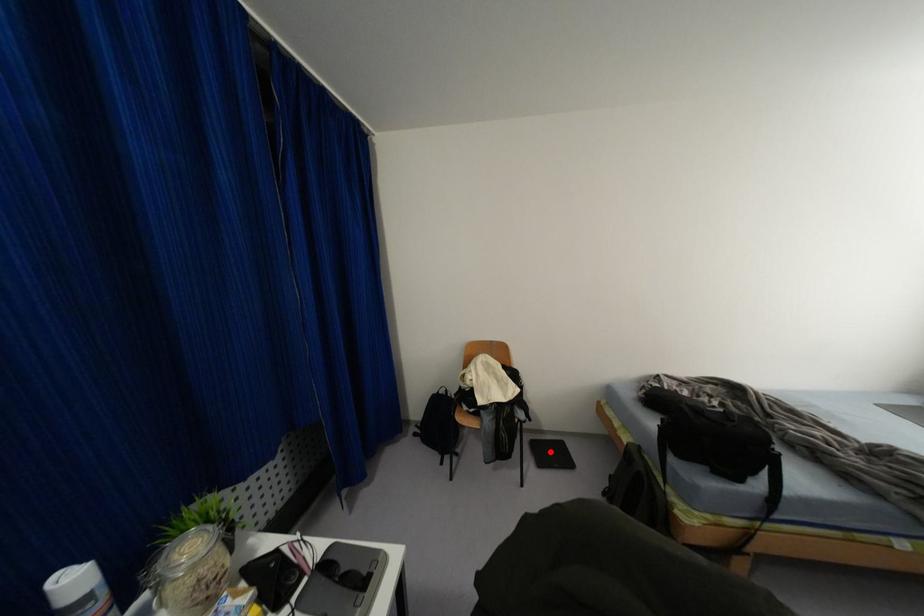
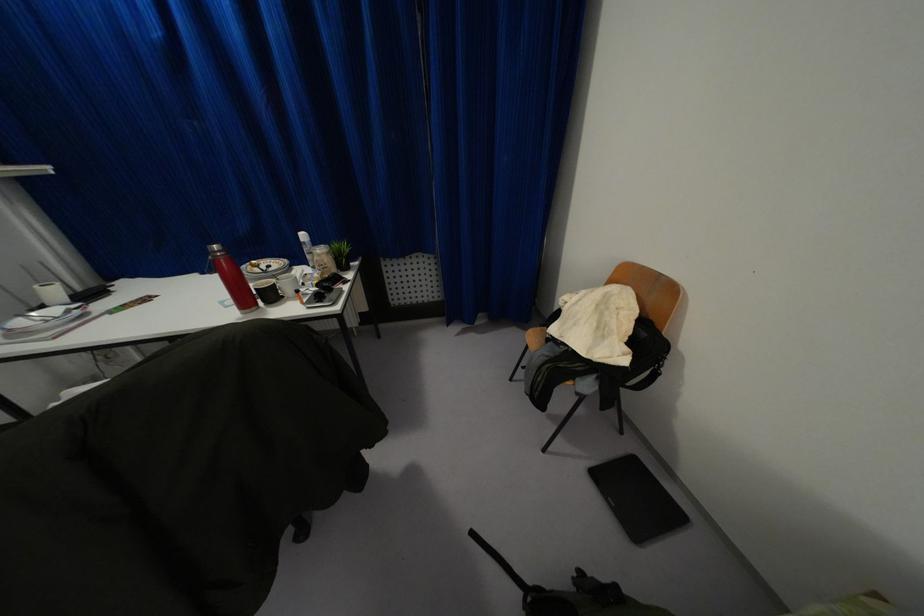
Question: I am providing you with two images of the same scene from different viewpoints. Given a red point in image1, look at the same physical point in image2. Is it:

Choices:
 (A) Closer to the viewpoint
 (B) Farther from the viewpoint

Answer: (A)